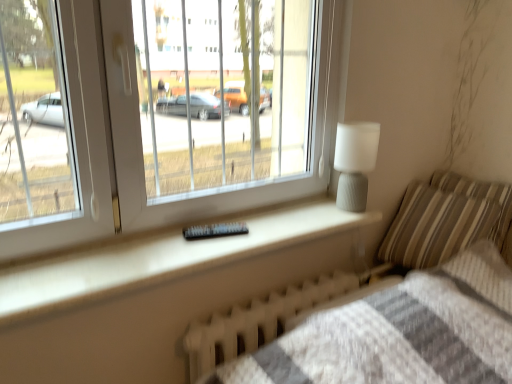
Question: From a real-world perspective, is white textured radiator at lower center physically located above or below striped fabric pillow at right, arranged as the 2th pillow when viewed from the left?

Choices:
 (A) above
 (B) below

Answer: (B)

Question: Is white textured radiator at lower center situated inside striped fabric pillow at right, arranged as the 1th pillow when viewed from the right, or outside?

Choices:
 (A) inside
 (B) outside

Answer: (B)

Question: Which object is the closest to the striped fabric pillow at right, which is the second pillow from right to left?

Choices:
 (A) white textured radiator at lower center
 (B) white matte lamp at upper right
 (C) white plastic window at upper left
 (D) striped fabric pillow at right, arranged as the 1th pillow when viewed from the right

Answer: (D)

Question: Estimate the real-world distances between objects in this image. Which object is closer to the white plastic window at upper left?

Choices:
 (A) striped fabric pillow at right, arranged as the first pillow when viewed from the left
 (B) white matte lamp at upper right
 (C) striped fabric pillow at right, arranged as the 1th pillow when viewed from the right
 (D) white textured radiator at lower center

Answer: (A)